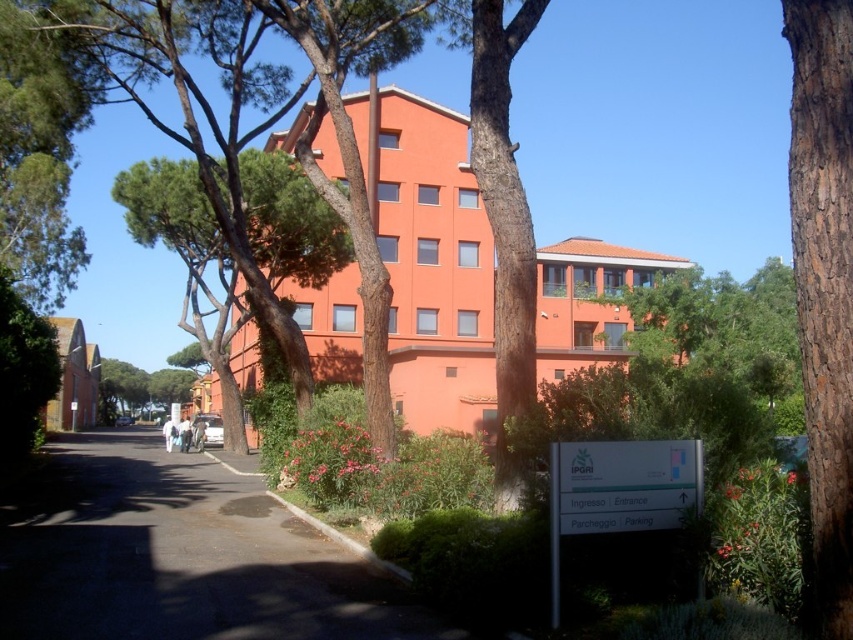
You are standing at the entrance of the building and see two points marked on the pathway. The first point is at coordinates point (x=132, y=221) and the second is at point (x=554, y=481). Which point is closer to you?

Point (x=132, y=221) is closer to you because it is further to the camera than point (x=554, y=481), meaning it is nearer in the scene.

You are a gardener planning to water both the green leafy tree at center and the brown rough bark tree at center. Which tree should you water first if you want to start from the lowest point?

The brown rough bark tree at center should be watered first because it is located below the green leafy tree at center, making it the lower one.

You are standing at the entrance of the building and want to reach the green rough bark tree at center. Which direction should you walk to get there?

The green rough bark tree at center is located at point coordinates, so you should walk towards the center of the image to reach it.